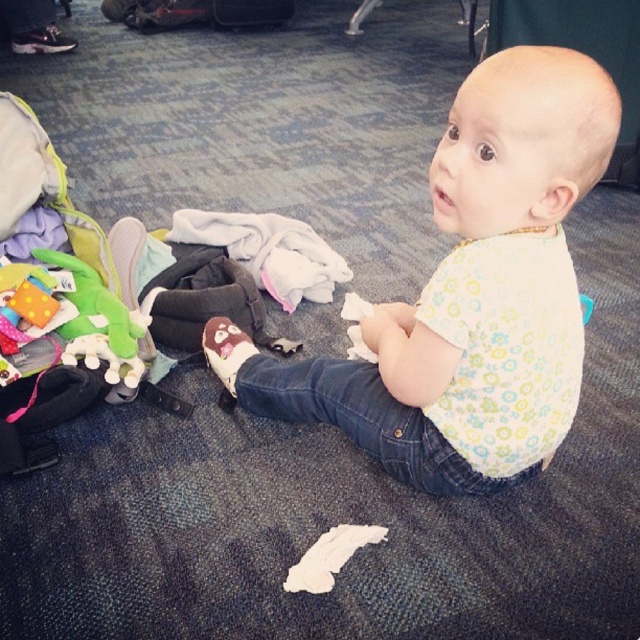
Question: Does white cotton bib at center have a lesser width compared to white soft cloth at center?

Choices:
 (A) no
 (B) yes

Answer: (A)

Question: Does white soft cloth at center appear under black hard suitcase at center?

Choices:
 (A) no
 (B) yes

Answer: (B)

Question: Considering the relative positions of white cotton bib at center and white soft cloth at center in the image provided, where is white cotton bib at center located with respect to white soft cloth at center?

Choices:
 (A) below
 (B) above

Answer: (A)

Question: Which point is closer to the camera taking this photo?

Choices:
 (A) [x=314, y=246]
 (B) [x=216, y=16]

Answer: (A)

Question: Which is farther from the white cotton bib at center?

Choices:
 (A) black hard suitcase at center
 (B) white soft cloth at center

Answer: (A)

Question: Which object is positioned closest to the white cotton bib at center?

Choices:
 (A) white soft cloth at center
 (B) black hard suitcase at center

Answer: (A)